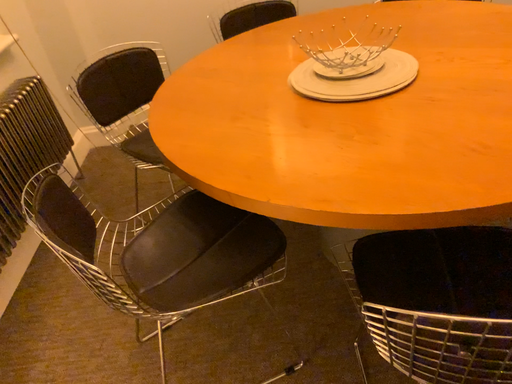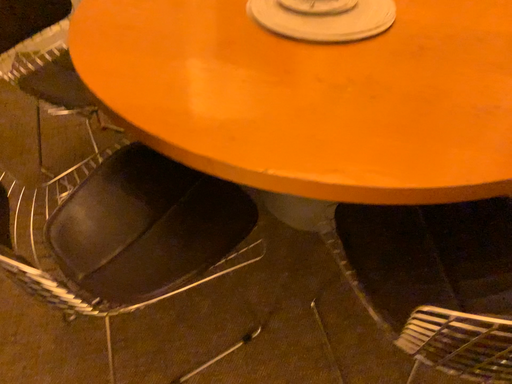
Question: How did the camera likely rotate when shooting the video?

Choices:
 (A) rotated right
 (B) rotated left

Answer: (A)